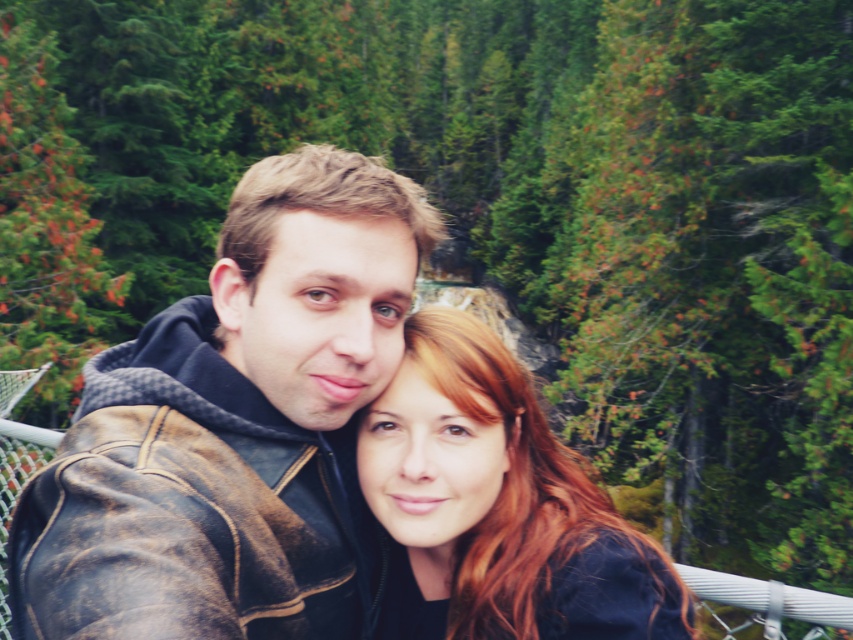
You are taking a selfie with two friends on a bridge. You notice two points marked in the image. The first point is at coordinates point (387, 323) and the second point is at point (517, 449). Based on the scene, which point is closer to the camera?

Point (387, 323) is in front of point (517, 449), so it is closer to the camera.

You are taking a selfie with two people. You want to ensure that both the brown leather jacket at center and the matte black hair at center are fully visible in the photo. Based on their positions, which object should you adjust to avoid being obscured?

The matte black hair at center is behind the brown leather jacket at center. To ensure both are fully visible, adjust the position of the matte black hair at center so it moves forward relative to the brown leather jacket at center.

You are taking a selfie with two people on a bridge. You notice a point at coordinates (234,428). Which person is this point on?

The point at coordinates (234,428) is on the brown leather jacket at center.